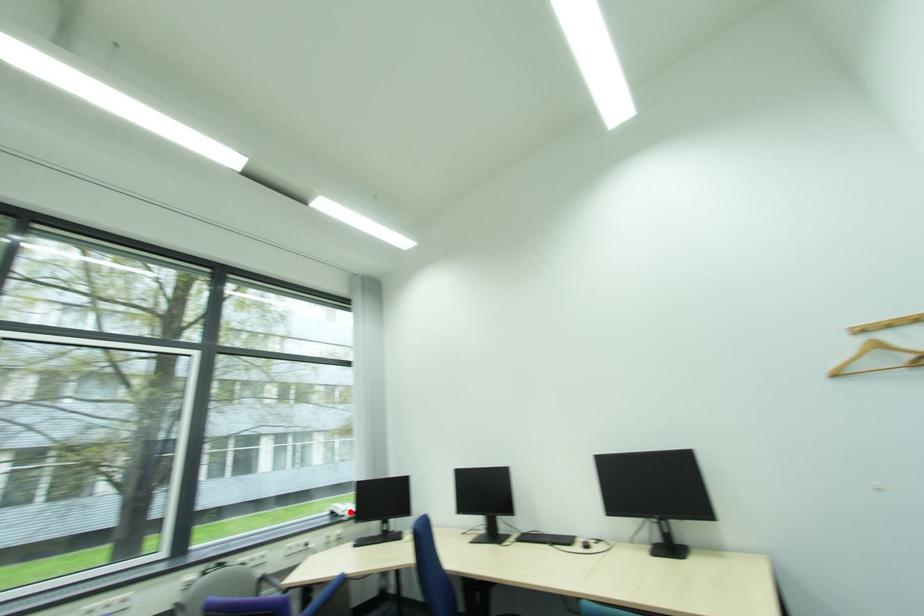
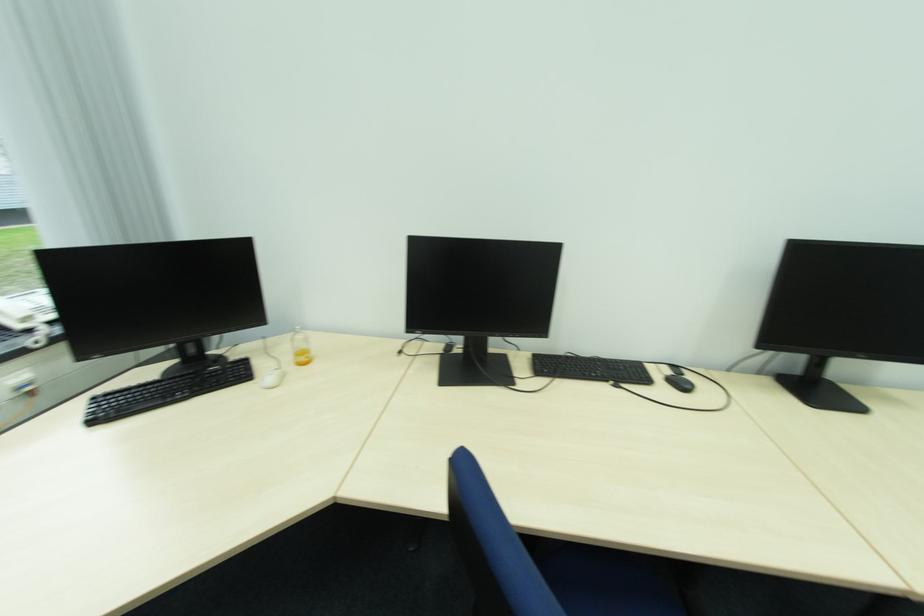
Find the pixel in the second image that matches the highlighted location in the first image.

(31, 320)